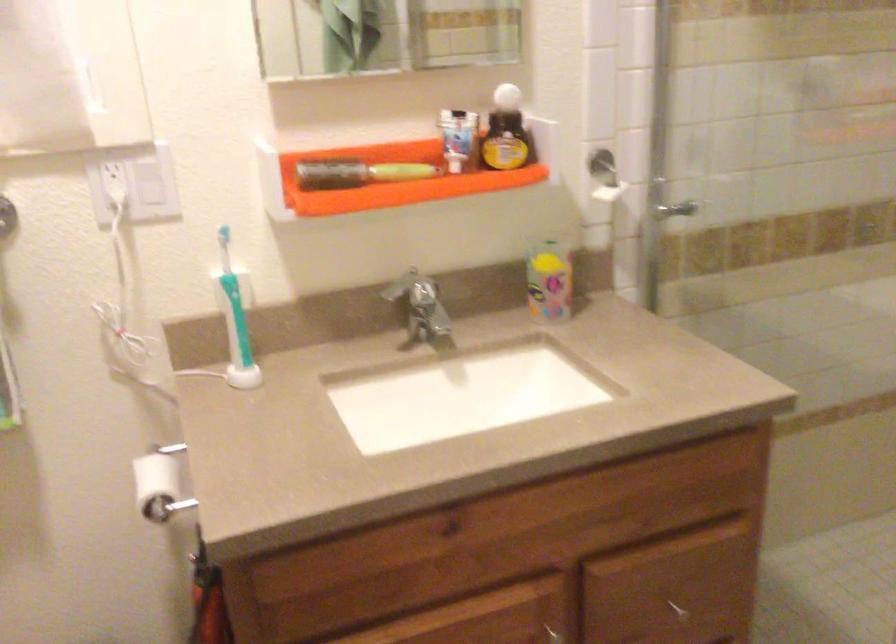
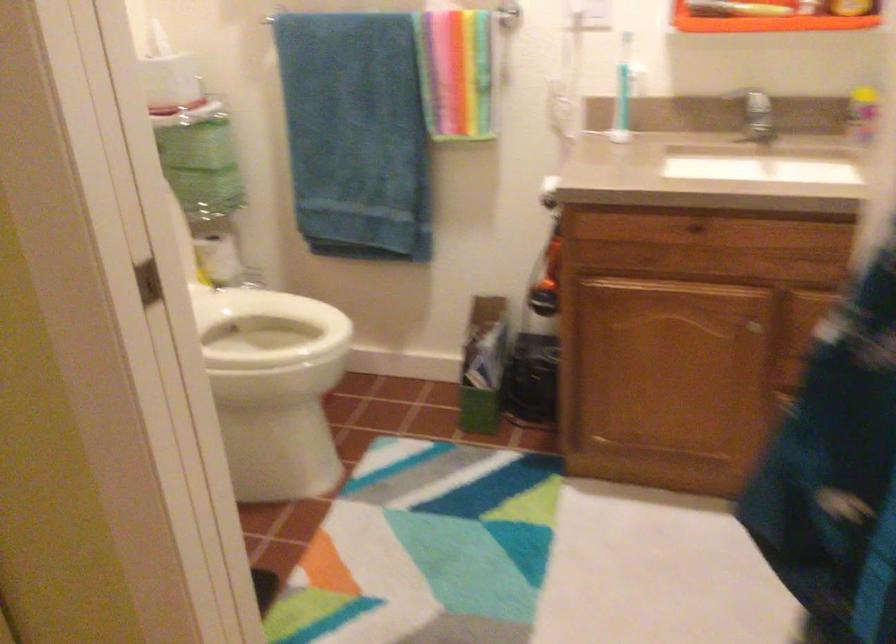
Question: I am providing you with two images of the same scene from different viewpoints. Please identify which objects are invisible in image2.

Choices:
 (A) white toilet paper roll
 (B) broom handle
 (C) white toilet seat
 (D) toilet paper roll

Answer: (A)